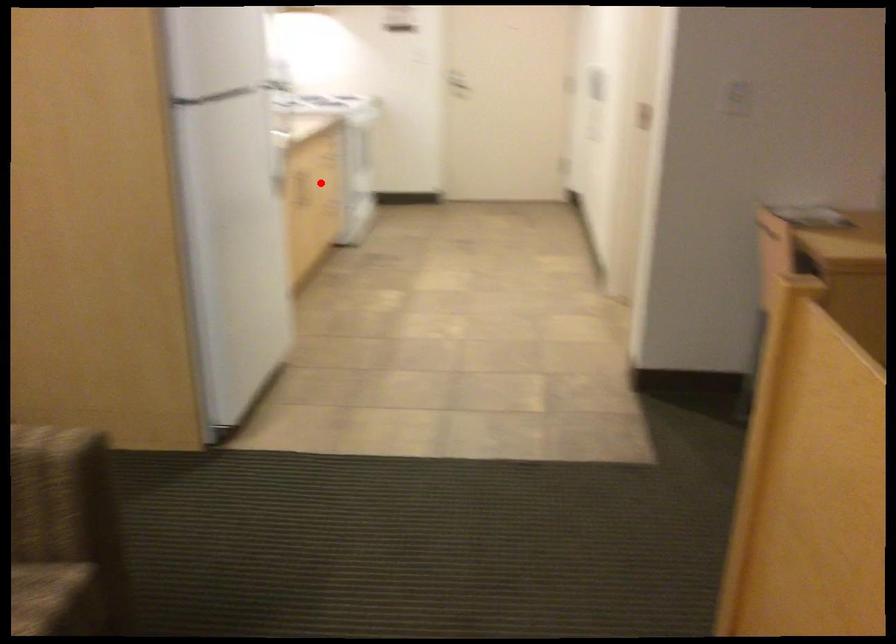
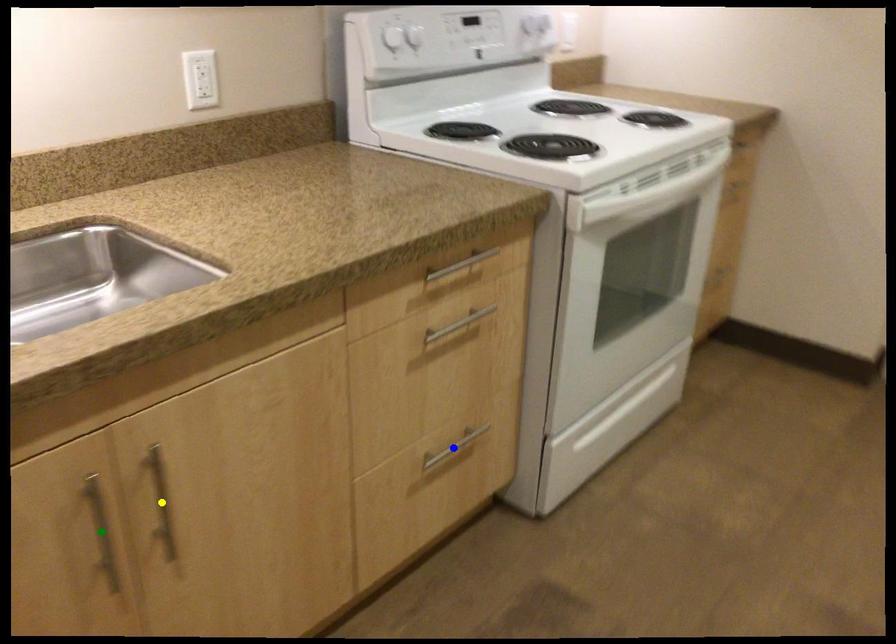
Question: I am providing you with two images of the same scene from different viewpoints. A red point is marked on the first image. You are given multiple points on the second image. Can you choose the point in image 2 that corresponds to the point in image 1?

Choices:
 (A) green point
 (B) blue point
 (C) yellow point

Answer: (C)